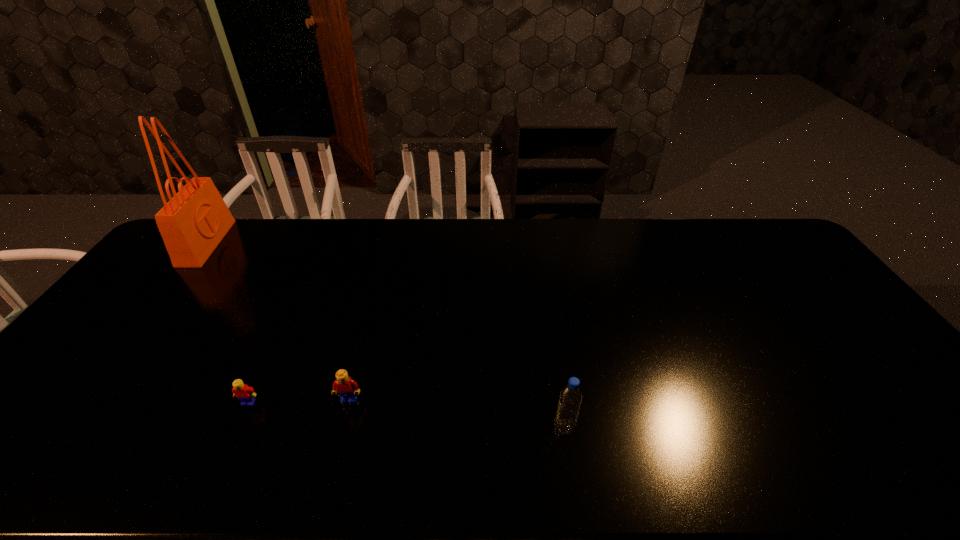
You are a GUI agent. You are given a task and a screenshot of the screen. Output one action in this format:
    pyautogui.click(x=<x>, y=<y>)
    Task: Click on the vacant space that satisfies the following two spatial constraints: 1. on the front-facing side of the second tallest object; 2. on the right side of the right Lego
    This screenshot has width=960, height=540.
    Given the screenshot: What is the action you would take?
    pyautogui.click(x=342, y=428)

The image size is (960, 540). Find the location of `vacant space that satisfies the following two spatial constraints: 1. on the logo side of the third shortest object; 2. on the right side of the leftmost object`. vacant space that satisfies the following two spatial constraints: 1. on the logo side of the third shortest object; 2. on the right side of the leftmost object is located at coordinates (62, 428).

Where is `vacant area that satisfies the following two spatial constraints: 1. on the back side of the water bottle; 2. on the logo side of the tallest object`? vacant area that satisfies the following two spatial constraints: 1. on the back side of the water bottle; 2. on the logo side of the tallest object is located at coordinates (535, 243).

What are the coordinates of `vacant area in the image that satisfies the following two spatial constraints: 1. on the logo side of the tallest object; 2. on the back side of the second tallest object` in the screenshot? It's located at (62, 428).

At what (x,y) coordinates should I click in order to perform the action: click on vacant area in the image that satisfies the following two spatial constraints: 1. on the back side of the nearest object; 2. on the logo side of the leftmost object. Please return your answer as a coordinate pair (x, y). Looking at the image, I should click on click(535, 243).